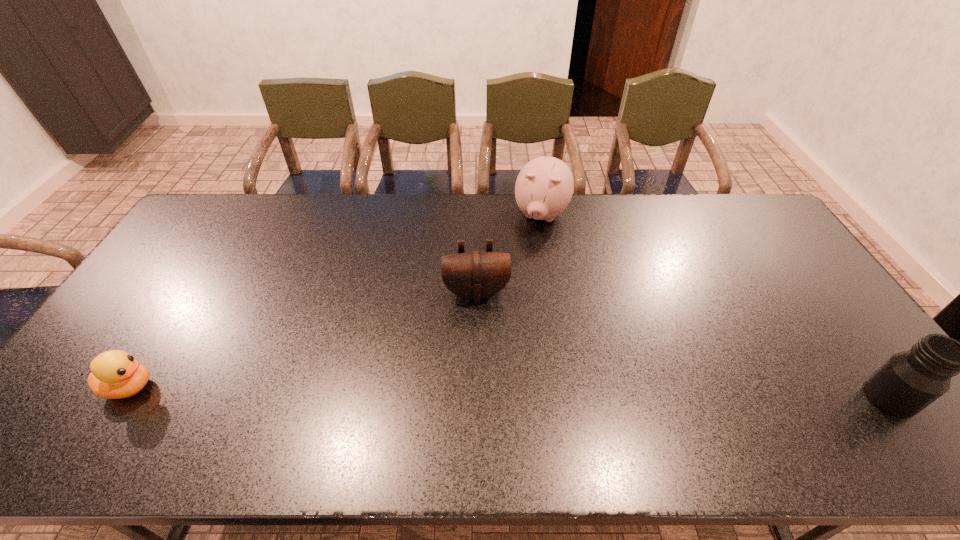
You are a GUI agent. You are given a task and a screenshot of the screen. Output one action in this format:
    pyautogui.click(x=<x>, y=<y>)
    Task: Click on the vacant point located 0.070m at the snout of the second object from right to left
    The height and width of the screenshot is (540, 960).
    Given the screenshot: What is the action you would take?
    pyautogui.click(x=532, y=250)

Where is `vacant region located with the flap open on the third nearest object`? The image size is (960, 540). vacant region located with the flap open on the third nearest object is located at coordinates (482, 350).

In order to click on vacant space located with the flap open on the third nearest object in this screenshot , I will do `click(481, 335)`.

At what (x,y) coordinates should I click in order to perform the action: click on vacant space situated with the flap open on the third nearest object. Please return your answer as a coordinate pair (x, y). This screenshot has width=960, height=540. Looking at the image, I should click on (482, 353).

Locate an element on the screen. object that is at the far edge is located at coordinates (544, 187).

Where is `duckling at the near edge`? The height and width of the screenshot is (540, 960). duckling at the near edge is located at coordinates click(x=115, y=374).

This screenshot has height=540, width=960. In order to click on jar at the near edge in this screenshot , I will do `click(908, 382)`.

The image size is (960, 540). In order to click on object that is positioned at the left edge in this screenshot , I will do `click(115, 374)`.

Where is `object present at the right edge`? This screenshot has height=540, width=960. object present at the right edge is located at coordinates [x=908, y=382].

Where is `object at the near left corner`? This screenshot has height=540, width=960. object at the near left corner is located at coordinates (115, 374).